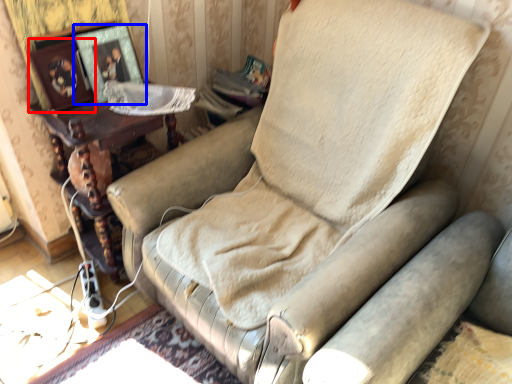
Question: Which object is further to the camera taking this photo, picture frame (highlighted by a red box) or picture frame (highlighted by a blue box)?

Choices:
 (A) picture frame
 (B) picture frame

Answer: (B)